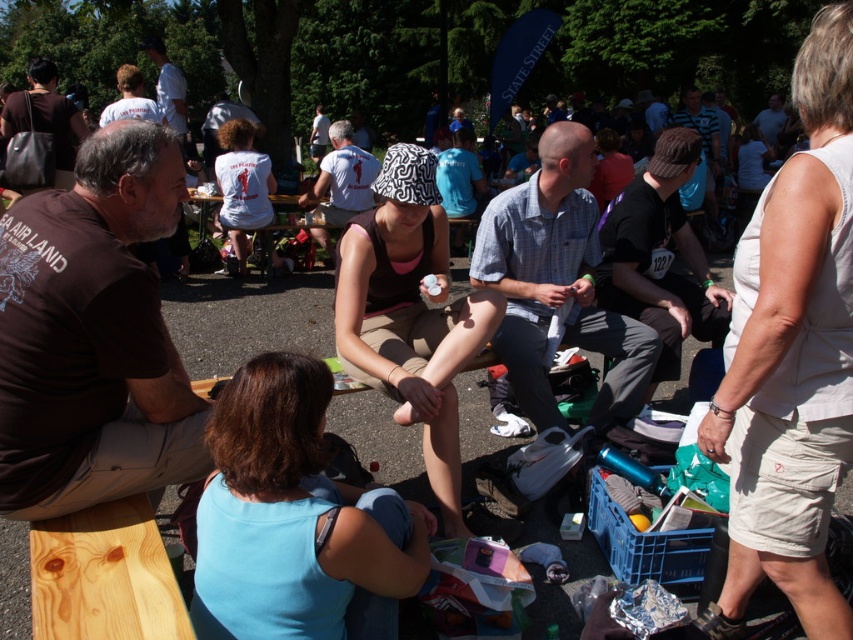
Which is behind, point (608, 406) or point (322, 170)?

The point (322, 170) is more distant.

Who is higher up, light blue plaid shirt at center or white printed t-shirt at center?

white printed t-shirt at center is above.

You are a GUI agent. You are given a task and a screenshot of the screen. Output one action in this format:
    pyautogui.click(x=<x>, y=<y>)
    Task: Click on the light blue plaid shirt at center
    The width and height of the screenshot is (853, 640).
    Given the screenshot: What is the action you would take?
    pyautogui.click(x=556, y=284)

Who is more forward, (340, 193) or (178, 136)?

Point (340, 193) is in front.

Where is `white printed t-shirt at center`? This screenshot has width=853, height=640. white printed t-shirt at center is located at coordinates (341, 179).

This screenshot has width=853, height=640. What do you see at coordinates (341, 179) in the screenshot? I see `white printed t-shirt at center` at bounding box center [341, 179].

Find the location of a particular element. The height and width of the screenshot is (640, 853). white printed t-shirt at center is located at coordinates (341, 179).

Who is shorter, black cotton shirt at center or white printed t-shirt at center?

black cotton shirt at center

Which is more to the right, black cotton shirt at center or white printed t-shirt at center?

From the viewer's perspective, black cotton shirt at center appears more on the right side.

Does point (699, 259) come in front of point (314, 237)?

Yes, it is in front of point (314, 237).

This screenshot has width=853, height=640. In order to click on black cotton shirt at center in this screenshot , I will do `click(660, 257)`.